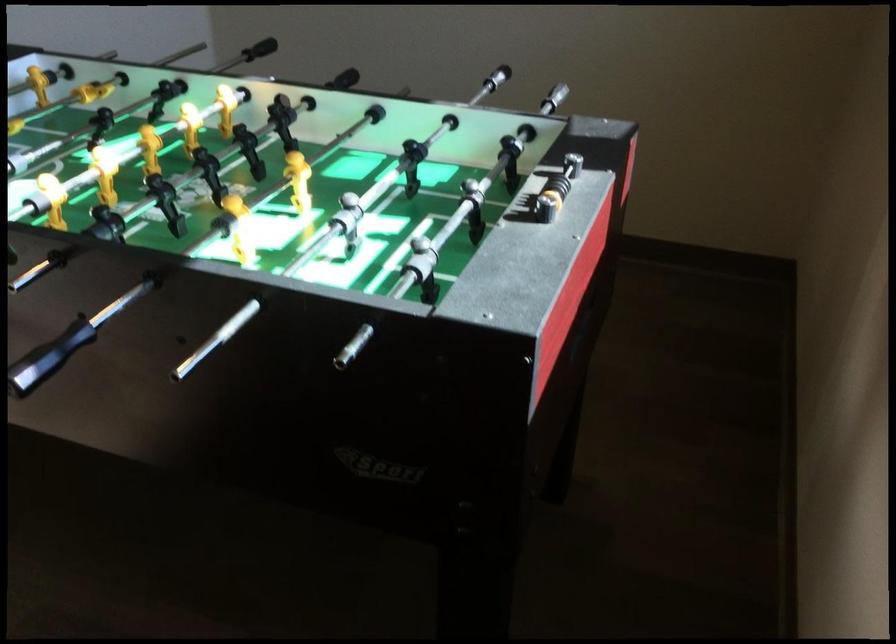
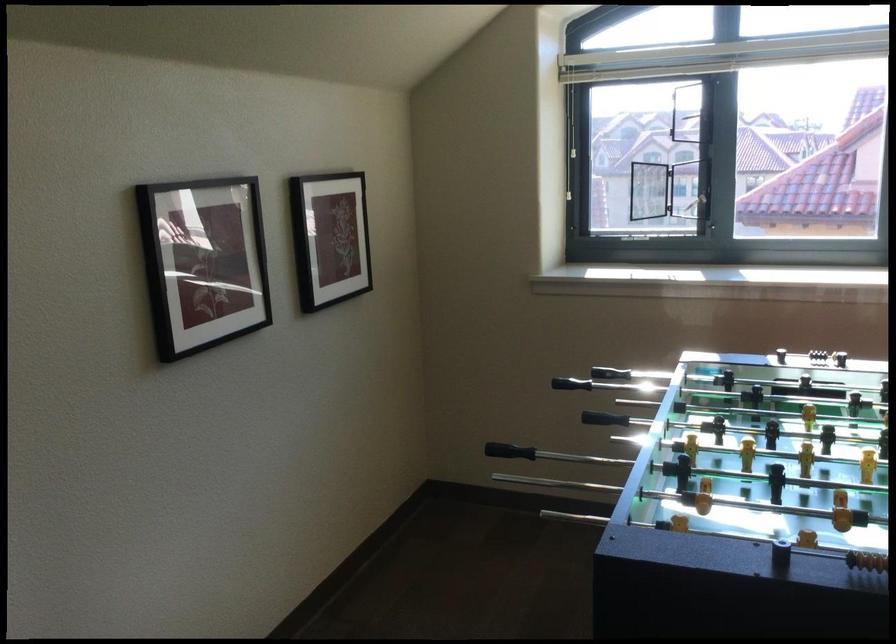
Where in the second image is the point corresponding to the point at 556,185 from the first image?

(814, 352)